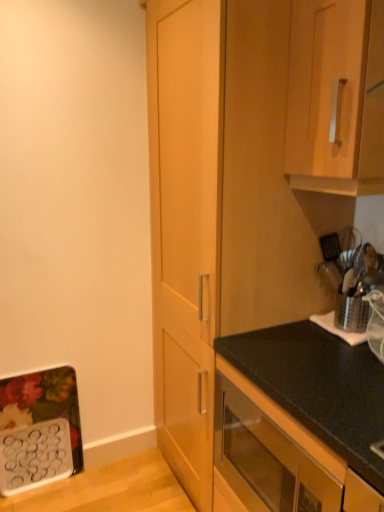
Question: Is black matte oven at lower center, which is counted as the 3th cabinetry, starting from the top, further to camera compared to wooden cabinet handle at upper right, the third cabinetry when ordered from bottom to top?

Choices:
 (A) yes
 (B) no

Answer: (B)

Question: From a real-world perspective, is black matte oven at lower center, the first cabinetry ordered from the bottom, located beneath wooden cabinet handle at upper right, which appears as the 1th cabinetry when viewed from the top?

Choices:
 (A) yes
 (B) no

Answer: (A)

Question: Is wooden cabinet handle at upper right, which appears as the 1th cabinetry when viewed from the top, at the back of black matte oven at lower center, the first cabinetry ordered from the bottom?

Choices:
 (A) yes
 (B) no

Answer: (B)

Question: Is black matte oven at lower center, which is counted as the 3th cabinetry, starting from the top, positioned before wooden cabinet handle at upper right, which appears as the 1th cabinetry when viewed from the top?

Choices:
 (A) no
 (B) yes

Answer: (B)

Question: Is black matte oven at lower center, which is counted as the 3th cabinetry, starting from the top, touching wooden cabinet handle at upper right, which appears as the 1th cabinetry when viewed from the top?

Choices:
 (A) yes
 (B) no

Answer: (B)

Question: From a real-world perspective, is wooden cabinet handle at upper right, which appears as the 1th cabinetry when viewed from the top, physically located above or below black matte oven at lower center, which is counted as the 3th cabinetry, starting from the top?

Choices:
 (A) below
 (B) above

Answer: (B)

Question: Considering the positions of point (359, 65) and point (243, 437), is point (359, 65) closer or farther from the camera than point (243, 437)?

Choices:
 (A) farther
 (B) closer

Answer: (B)

Question: Is wooden cabinet handle at upper right, which appears as the 1th cabinetry when viewed from the top, wider or thinner than black matte oven at lower center, which is counted as the 3th cabinetry, starting from the top?

Choices:
 (A) thin
 (B) wide

Answer: (B)

Question: Considering the positions of wooden cabinet handle at upper right, the third cabinetry when ordered from bottom to top, and black matte oven at lower center, the first cabinetry ordered from the bottom, in the image, is wooden cabinet handle at upper right, the third cabinetry when ordered from bottom to top, bigger or smaller than black matte oven at lower center, the first cabinetry ordered from the bottom,?

Choices:
 (A) big
 (B) small

Answer: (B)

Question: Relative to wooden cabinet at center, the second cabinetry viewed from the top, is wooden cabinet handle at upper right, which appears as the 1th cabinetry when viewed from the top, in front or behind?

Choices:
 (A) behind
 (B) front

Answer: (B)

Question: From their relative heights in the image, would you say wooden cabinet handle at upper right, the third cabinetry when ordered from bottom to top, is taller or shorter than wooden cabinet at center, the second cabinetry viewed from the top?

Choices:
 (A) short
 (B) tall

Answer: (A)

Question: Looking at the image, does wooden cabinet handle at upper right, which appears as the 1th cabinetry when viewed from the top, seem bigger or smaller compared to wooden cabinet at center, acting as the second cabinetry starting from the bottom?

Choices:
 (A) big
 (B) small

Answer: (B)

Question: Is wooden cabinet handle at upper right, the third cabinetry when ordered from bottom to top, wider or thinner than wooden cabinet at center, acting as the second cabinetry starting from the bottom?

Choices:
 (A) thin
 (B) wide

Answer: (A)

Question: In terms of height, does silver metallic utensil holder at right look taller or shorter compared to wooden cabinet at center, the second cabinetry viewed from the top?

Choices:
 (A) short
 (B) tall

Answer: (A)

Question: From a real-world perspective, is silver metallic utensil holder at right physically located above or below wooden cabinet at center, the second cabinetry viewed from the top?

Choices:
 (A) above
 (B) below

Answer: (B)